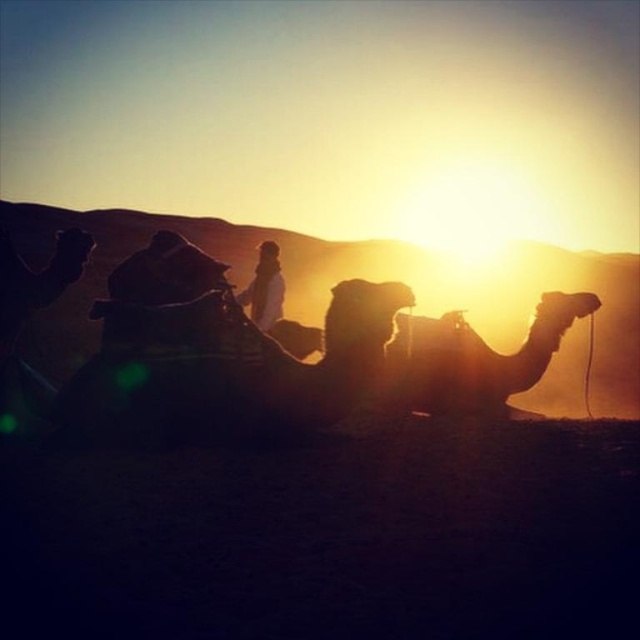
Does brown textured camel at center have a greater height compared to white textured clothing at center?

Yes, brown textured camel at center is taller than white textured clothing at center.

Does point (445, 392) come farther from viewer compared to point (268, 320)?

No, (445, 392) is in front of (268, 320).

Is point (406, 326) more distant than point (268, 240)?

No, (406, 326) is in front of (268, 240).

This screenshot has height=640, width=640. I want to click on brown textured camel at center, so click(474, 356).